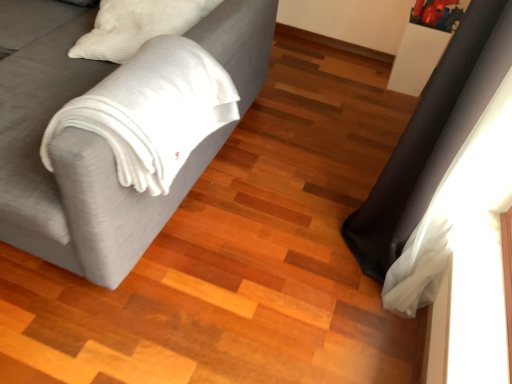
This screenshot has height=384, width=512. What do you see at coordinates (456, 206) in the screenshot? I see `black leather curtain at right` at bounding box center [456, 206].

Locate an element on the screen. black leather curtain at right is located at coordinates (456, 206).

Measure the distance between black leather curtain at right and camera.

black leather curtain at right and camera are 3.41 feet apart.

Find the location of a particular element. The image size is (512, 384). velvet gray couch at left is located at coordinates (105, 208).

What do you see at coordinates (105, 208) in the screenshot?
I see `velvet gray couch at left` at bounding box center [105, 208].

What is the approximate height of velvet gray couch at left?

35.40 inches.

Identify the location of black leather curtain at right. This screenshot has width=512, height=384. (456, 206).

Is velvet gray couch at left at the left side of black leather curtain at right?

Indeed, velvet gray couch at left is positioned on the left side of black leather curtain at right.

In the image, is velvet gray couch at left positioned in front of or behind black leather curtain at right?

Clearly, velvet gray couch at left is in front of black leather curtain at right.

Which is closer, (x=258, y=62) or (x=420, y=252)?

The point (x=420, y=252) is closer to the camera.

From the image's perspective, is velvet gray couch at left on top of black leather curtain at right?

Yes, from the image's perspective, velvet gray couch at left is above black leather curtain at right.

From a real-world perspective, is velvet gray couch at left physically above black leather curtain at right?

Actually, velvet gray couch at left is physically below black leather curtain at right in the real world.

Which object is wider, velvet gray couch at left or black leather curtain at right?

velvet gray couch at left is wider.

Between velvet gray couch at left and black leather curtain at right, which one has less height?

Standing shorter between the two is velvet gray couch at left.

Can you confirm if velvet gray couch at left is smaller than black leather curtain at right?

No, velvet gray couch at left is not smaller than black leather curtain at right.

Could black leather curtain at right be considered to be inside velvet gray couch at left?

No, black leather curtain at right is not a part of velvet gray couch at left.

Is velvet gray couch at left positioned far away from black leather curtain at right?

No, velvet gray couch at left is in close proximity to black leather curtain at right.

Is black leather curtain at right at the back of velvet gray couch at left?

That's not correct — velvet gray couch at left is not looking away from black leather curtain at right.

Identify the location of curtain that appears above the velvet gray couch at left (from a real-world perspective). The height and width of the screenshot is (384, 512). (456, 206).

Which is more to the right, black leather curtain at right or velvet gray couch at left?

black leather curtain at right.

Is the position of black leather curtain at right more distant than that of velvet gray couch at left?

Yes, it is behind velvet gray couch at left.

Is point (435, 215) closer or farther from the camera than point (84, 190)?

Point (435, 215) is farther from the camera than point (84, 190).

From the image's perspective, is black leather curtain at right positioned above or below velvet gray couch at left?

From the image's perspective, black leather curtain at right appears below velvet gray couch at left.

From a real-world perspective, between black leather curtain at right and velvet gray couch at left, who is vertically lower?

velvet gray couch at left.

Considering the relative sizes of black leather curtain at right and velvet gray couch at left in the image provided, is black leather curtain at right wider than velvet gray couch at left?

In fact, black leather curtain at right might be narrower than velvet gray couch at left.

Which of these two, black leather curtain at right or velvet gray couch at left, stands shorter?

velvet gray couch at left is shorter.

Does black leather curtain at right have a larger size compared to velvet gray couch at left?

Actually, black leather curtain at right might be smaller than velvet gray couch at left.

Choose the correct answer: Is black leather curtain at right inside velvet gray couch at left or outside it?

black leather curtain at right lies outside velvet gray couch at left.

Is the surface of black leather curtain at right in direct contact with velvet gray couch at left?

black leather curtain at right is not next to velvet gray couch at left, and they're not touching.

Looking at this image, is black leather curtain at right oriented towards velvet gray couch at left?

Yes.

Where is `studio couch located underneath the black leather curtain at right (from a real-world perspective)`? This screenshot has height=384, width=512. studio couch located underneath the black leather curtain at right (from a real-world perspective) is located at coordinates (105, 208).

At what (x,y) coordinates should I click in order to perform the action: click on curtain located on the right of velvet gray couch at left. Please return your answer as a coordinate pair (x, y). Looking at the image, I should click on [x=456, y=206].

The image size is (512, 384). What are the coordinates of `studio couch that appears in front of the black leather curtain at right` in the screenshot? It's located at (105, 208).